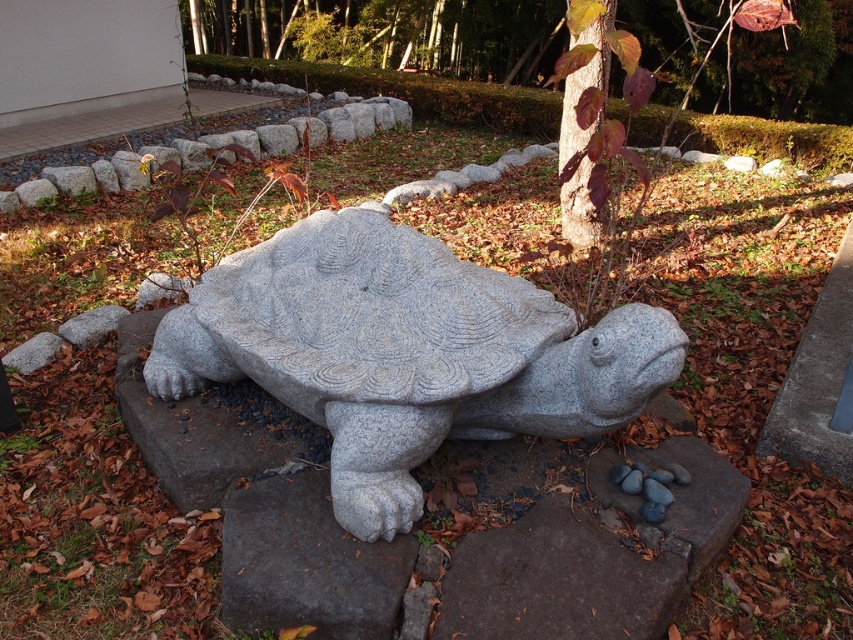
Between granite tortoise at center and green textured tree at upper center, which one appears on the left side from the viewer's perspective?

Positioned to the left is granite tortoise at center.

Is granite tortoise at center positioned in front of green textured tree at upper center?

Yes, granite tortoise at center is in front of green textured tree at upper center.

Which is in front, point (431, 451) or point (759, 109)?

Point (431, 451) is in front.

The image size is (853, 640). In order to click on granite tortoise at center in this screenshot , I will do `click(404, 353)`.

Between point (782, 97) and point (577, 72), which one is positioned in front?

Point (577, 72)

Can you confirm if green textured tree at upper center is positioned above smooth bark tree at center?

Correct, green textured tree at upper center is located above smooth bark tree at center.

Is point (213, 38) farther from camera compared to point (589, 205)?

Yes, point (213, 38) is behind point (589, 205).

You are a GUI agent. You are given a task and a screenshot of the screen. Output one action in this format:
    pyautogui.click(x=<x>, y=<y>)
    Task: Click on the green textured tree at upper center
    The image size is (853, 640).
    Given the screenshot: What is the action you would take?
    pyautogui.click(x=434, y=35)

Between point (552, 336) and point (563, 154), which one is positioned behind?

The point (563, 154) is more distant.

Does granite tortoise at center appear on the right side of smooth bark tree at center?

In fact, granite tortoise at center is to the left of smooth bark tree at center.

This screenshot has width=853, height=640. Find the location of `granite tortoise at center`. granite tortoise at center is located at coordinates (404, 353).

The width and height of the screenshot is (853, 640). What are the coordinates of `granite tortoise at center` in the screenshot? It's located at (404, 353).